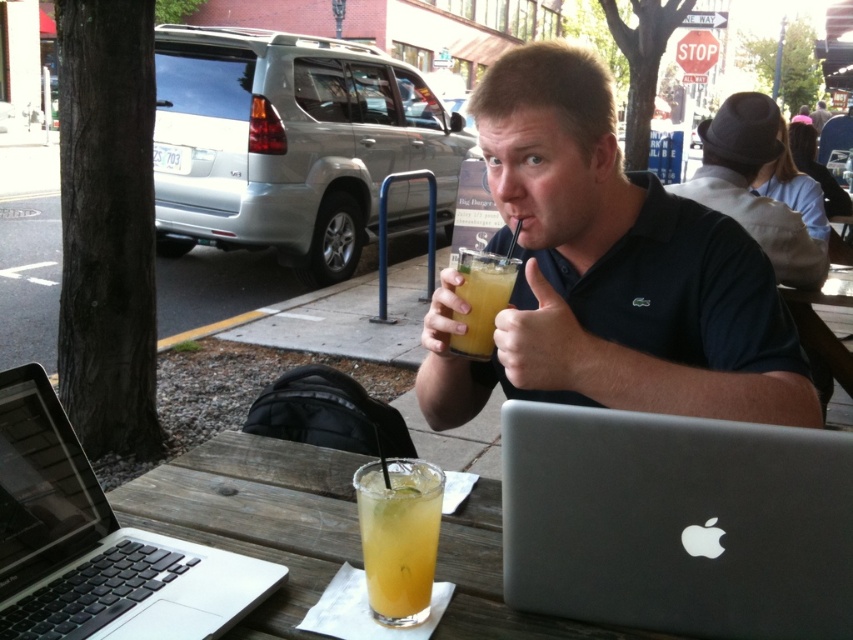
Question: Is wooden table at center to the right of yellow translucent glass at center from the viewer's perspective?

Choices:
 (A) yes
 (B) no

Answer: (B)

Question: Is silver metallic laptop at lower right positioned before gray felt hat at upper right?

Choices:
 (A) yes
 (B) no

Answer: (A)

Question: Among these objects, which one is farthest from the camera?

Choices:
 (A) translucent glass at center
 (B) gray felt hat at upper right
 (C) yellow translucent glass at center

Answer: (B)

Question: Estimate the real-world distances between objects in this image. Which object is farther from the silver metallic laptop at lower right?

Choices:
 (A) silver metallic laptop at center
 (B) gray felt hat at upper right
 (C) translucent glass at center

Answer: (B)

Question: Which point is closer to the camera?

Choices:
 (A) wooden table at center
 (B) matte black polo shirt at center

Answer: (A)

Question: Does silver metallic laptop at lower right have a smaller size compared to gray felt hat at upper right?

Choices:
 (A) yes
 (B) no

Answer: (A)